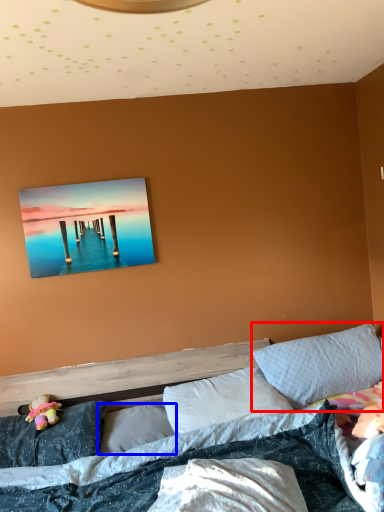
Question: Which point is further to the camera, pillow (highlighted by a red box) or pillow (highlighted by a blue box)?

Choices:
 (A) pillow
 (B) pillow

Answer: (A)